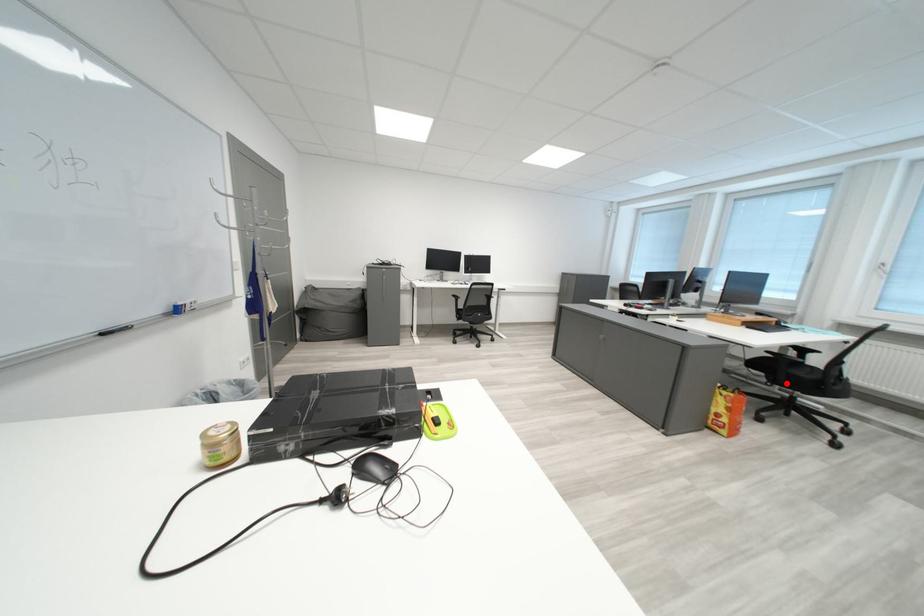
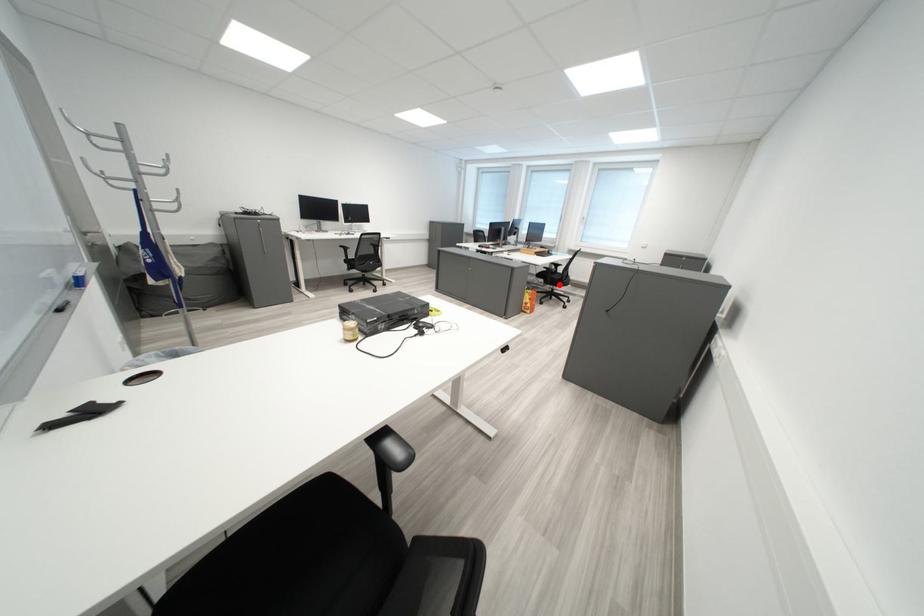
I am providing you with two images of the same scene from different viewpoints. A red point is marked on the first image and another point is marked on the second image. Does the point marked in image1 correspond to the same location as the one in image2?

Yes